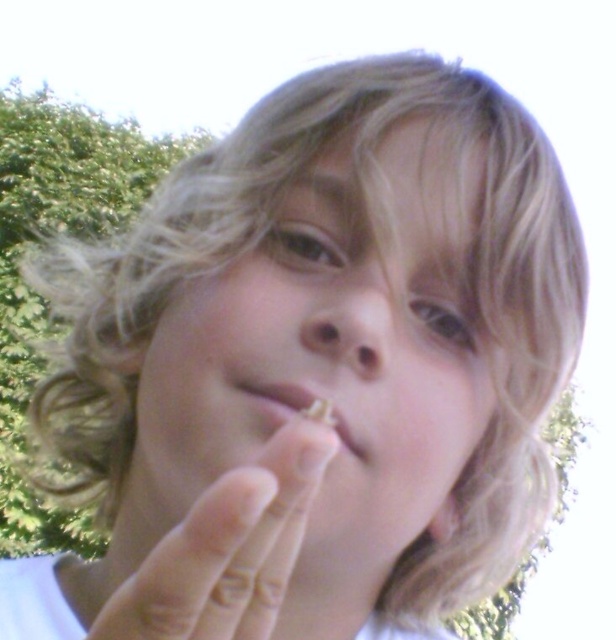
Does point (339, 458) lie behind point (298, 396)?

Yes, point (339, 458) is farther from viewer.

Does smooth skin face at center appear on the right side of matte plastic mouth at center?

Indeed, smooth skin face at center is positioned on the right side of matte plastic mouth at center.

Is point (403, 515) positioned in front of point (277, 388)?

No, (403, 515) is behind (277, 388).

This screenshot has height=640, width=616. In order to click on smooth skin face at center in this screenshot , I will do `click(330, 353)`.

Between matte skin nose at center and matte plastic mouth at center, which one is positioned lower?

matte plastic mouth at center is below.

The height and width of the screenshot is (640, 616). I want to click on matte skin nose at center, so click(x=349, y=332).

Describe the element at coordinates (330, 353) in the screenshot. This screenshot has height=640, width=616. I see `smooth skin face at center` at that location.

Measure the distance from smooth skin face at center to smooth skin finger at center.

The distance of smooth skin face at center from smooth skin finger at center is 3.05 inches.

Does point (460, 394) lie in front of point (274, 518)?

No, (460, 394) is behind (274, 518).

You are a GUI agent. You are given a task and a screenshot of the screen. Output one action in this format:
    pyautogui.click(x=<x>, y=<y>)
    Task: Click on the smooth skin face at center
    
    Given the screenshot: What is the action you would take?
    pyautogui.click(x=330, y=353)